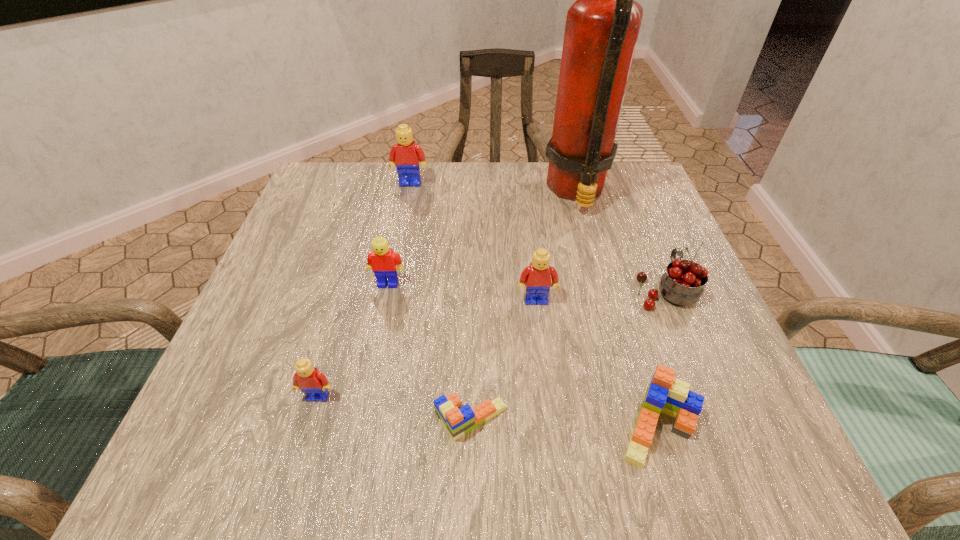
Locate an element on the screen. The width and height of the screenshot is (960, 540). free point between the third shortest object and the red cherry is located at coordinates (492, 343).

The height and width of the screenshot is (540, 960). What are the coordinates of `empty space between the shortest object and the fifth nearest Lego` in the screenshot? It's located at (429, 352).

Image resolution: width=960 pixels, height=540 pixels. In order to click on vacant point located between the fifth tallest Lego and the red cherry in this screenshot , I will do `click(662, 359)`.

Locate an element on the screen. The height and width of the screenshot is (540, 960). free space between the third nearest yellow Lego and the farthest Lego is located at coordinates (399, 233).

The height and width of the screenshot is (540, 960). In order to click on unoccupied position between the cherry and the fourth nearest Lego in this screenshot , I will do `click(601, 295)`.

Locate an element on the screen. free space between the second farthest yellow Lego and the fire extinguisher is located at coordinates (483, 238).

At what (x,y) coordinates should I click in order to perform the action: click on free space between the second tallest object and the third nearest yellow Lego. Please return your answer as a coordinate pair (x, y). Looking at the image, I should click on (399, 233).

The width and height of the screenshot is (960, 540). Find the location of `free space between the shortest object and the cherry`. free space between the shortest object and the cherry is located at coordinates (568, 355).

Image resolution: width=960 pixels, height=540 pixels. Identify the location of vacant space that is in between the third nearest yellow Lego and the smallest yellow Lego. point(353,340).

In order to click on vacant space that is in between the red fire extinguisher and the cherry in this screenshot , I will do `click(621, 241)`.